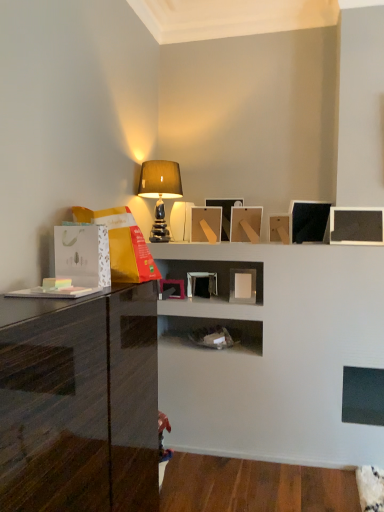
Question: Is matte beige lampshade at upper center far away from matte wood picture frame at center?

Choices:
 (A) yes
 (B) no

Answer: (B)

Question: Is matte beige lampshade at upper center to the right of matte wood picture frame at center from the viewer's perspective?

Choices:
 (A) yes
 (B) no

Answer: (B)

Question: From a real-world perspective, is matte beige lampshade at upper center physically below matte wood picture frame at center?

Choices:
 (A) yes
 (B) no

Answer: (B)

Question: Can you confirm if matte beige lampshade at upper center is smaller than matte wood picture frame at center?

Choices:
 (A) yes
 (B) no

Answer: (B)

Question: Is matte beige lampshade at upper center aimed at matte wood picture frame at center?

Choices:
 (A) yes
 (B) no

Answer: (B)

Question: Is matte wood picture frame at center in front of or behind matte beige lampshade at upper center in the image?

Choices:
 (A) front
 (B) behind

Answer: (B)

Question: From the image's perspective, is matte wood picture frame at center positioned above or below matte beige lampshade at upper center?

Choices:
 (A) above
 (B) below

Answer: (B)

Question: From a real-world perspective, relative to matte beige lampshade at upper center, is matte wood picture frame at center vertically above or below?

Choices:
 (A) above
 (B) below

Answer: (B)

Question: Is matte wood picture frame at center inside the boundaries of matte beige lampshade at upper center, or outside?

Choices:
 (A) outside
 (B) inside

Answer: (A)

Question: From the image's perspective, is glossy black cabinet at left positioned above or below matte beige lampshade at upper center?

Choices:
 (A) below
 (B) above

Answer: (A)

Question: Considering the positions of point (135, 352) and point (168, 173), is point (135, 352) closer or farther from the camera than point (168, 173)?

Choices:
 (A) closer
 (B) farther

Answer: (A)

Question: Relative to matte beige lampshade at upper center, is glossy black cabinet at left in front or behind?

Choices:
 (A) behind
 (B) front

Answer: (B)

Question: Considering the positions of glossy black cabinet at left and matte beige lampshade at upper center in the image, is glossy black cabinet at left wider or thinner than matte beige lampshade at upper center?

Choices:
 (A) thin
 (B) wide

Answer: (B)

Question: Would you say matte beige lampshade at upper center is to the left or to the right of glossy black cabinet at left in the picture?

Choices:
 (A) right
 (B) left

Answer: (A)

Question: Considering the positions of point (139, 183) and point (87, 369), is point (139, 183) closer or farther from the camera than point (87, 369)?

Choices:
 (A) closer
 (B) farther

Answer: (B)